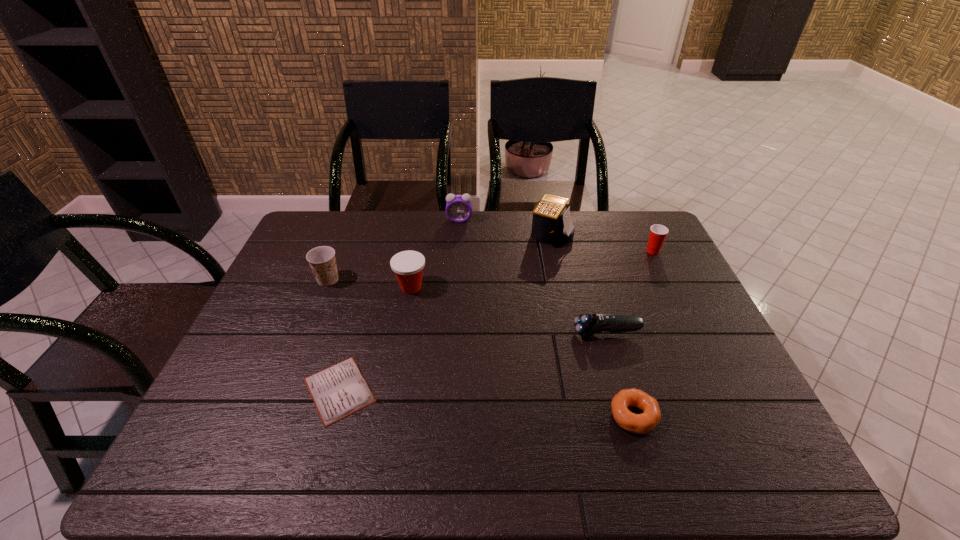
I want to click on calculator situated at the far edge, so click(x=551, y=224).

The width and height of the screenshot is (960, 540). Identify the location of alarm clock at the far edge. (458, 207).

Find the location of a particular element. This screenshot has height=540, width=960. Dixie cup located in the far edge section of the desktop is located at coordinates (658, 232).

You are a GUI agent. You are given a task and a screenshot of the screen. Output one action in this format:
    pyautogui.click(x=<x>, y=<y>)
    Task: Click on the object present at the near edge
    The height and width of the screenshot is (540, 960).
    Given the screenshot: What is the action you would take?
    click(643, 423)

Where is `object that is at the left edge`? The width and height of the screenshot is (960, 540). object that is at the left edge is located at coordinates (322, 261).

Find the location of a particular element. object present at the right edge is located at coordinates (658, 232).

Image resolution: width=960 pixels, height=540 pixels. In order to click on object present at the far right corner in this screenshot , I will do `click(658, 232)`.

Find the location of a particular element. The image size is (960, 540). vacant point at the far edge is located at coordinates (588, 214).

Where is `free region at the near edge of the desktop`? free region at the near edge of the desktop is located at coordinates (396, 438).

Where is `vacant space at the left edge of the desktop`? Image resolution: width=960 pixels, height=540 pixels. vacant space at the left edge of the desktop is located at coordinates pos(304,266).